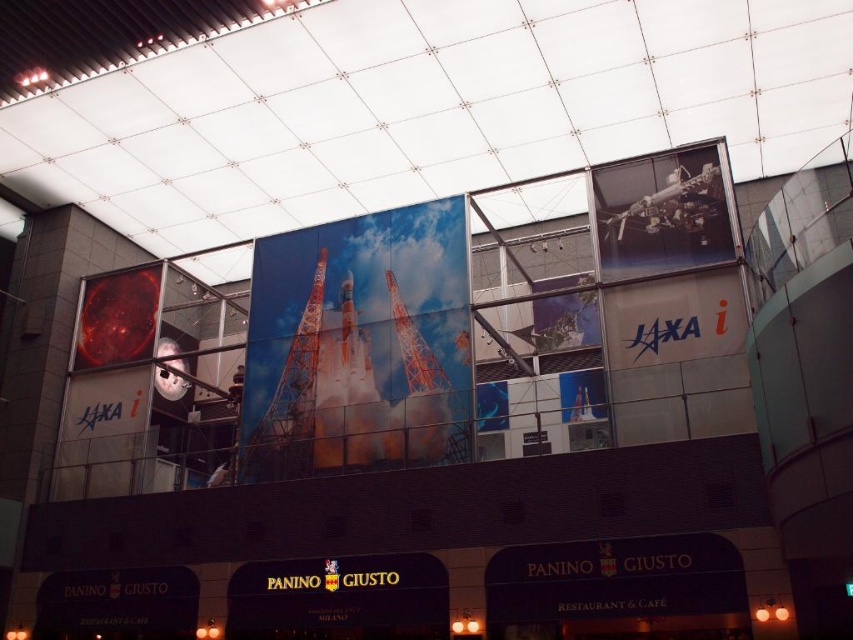
Question: Estimate the real-world distances between objects in this image. Which object is farther from the metallic orange rocket at center?

Choices:
 (A) orange matte rocket at center
 (B) metallic rocket at center

Answer: (B)

Question: Does metallic rocket at center appear under orange matte rocket at center?

Choices:
 (A) yes
 (B) no

Answer: (B)

Question: Estimate the real-world distances between objects in this image. Which object is farther from the metallic orange rocket at center?

Choices:
 (A) metallic rocket at center
 (B) orange matte rocket at center

Answer: (A)

Question: In this image, where is metallic rocket at center located relative to orange matte rocket at center?

Choices:
 (A) above
 (B) below

Answer: (A)

Question: Considering the relative positions of metallic rocket at center and orange matte rocket at center in the image provided, where is metallic rocket at center located with respect to orange matte rocket at center?

Choices:
 (A) above
 (B) below

Answer: (A)

Question: Which object is farther from the camera taking this photo?

Choices:
 (A) metallic orange rocket at center
 (B) orange matte rocket at center
 (C) metallic rocket at center

Answer: (A)